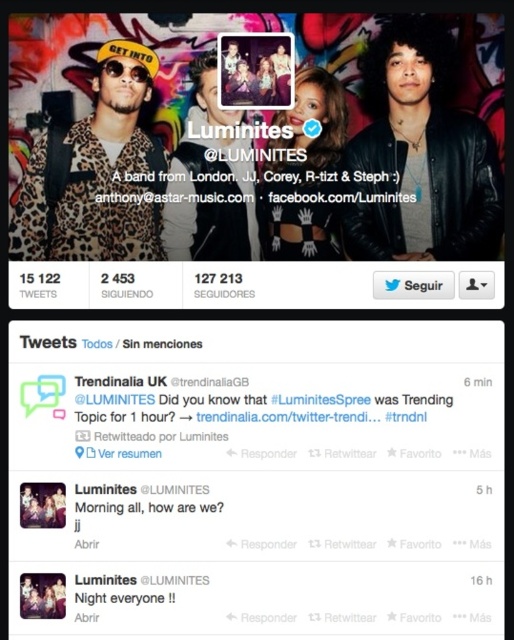
You are a photographer standing 2 meters away from the graffiti wall in the Luminites Twitter profile picture. You want to take a closeup shot of the point at coordinates point [337,209]. Can you reach this point with your camera lens without moving closer than 1.5 meters to the wall?

The point [337,209] is 1.51 meters away from the viewer. Since you are currently 2 meters away, you need to move closer to 1.51 meters to reach it. However, the requirement states you cannot move closer than 1.5 meters. Since 1.51 meters is just beyond the 1.5 meters limit, you cannot reach the point without violating the distance constraint. You would need to adjust your position slightly closer or use a different lens with a longer focal length to capture the point from your current distance.

You are a graphic designer working on a new layout for the Luminites Twitter profile. You need to place a new promotional sticker exactly where the matte black top at center is currently located. What are the coordinates where you should place the sticker?

The coordinates for the matte black top at center are at point (303, 173), so you should place the sticker there.